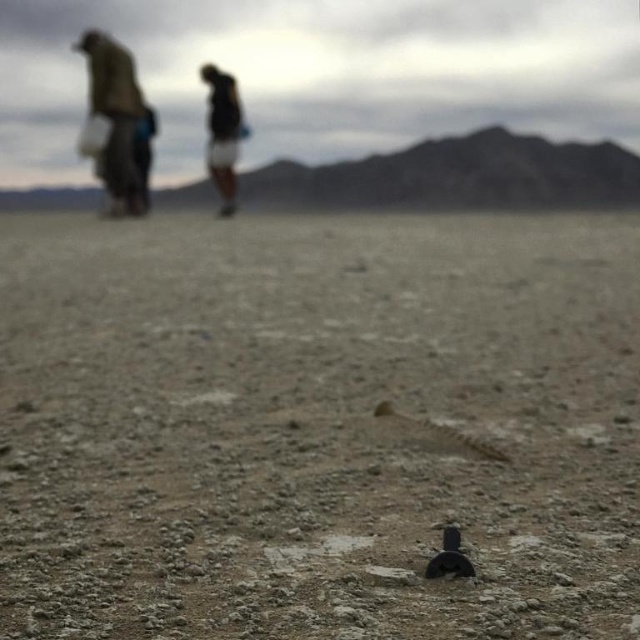
You are a traveler in the desert and see two jackets hanging on a cactus. The jackets are the brown fabric jacket at upper left and the dark brown leather jacket at upper center. Which jacket is closer to the left side of the cactus?

The brown fabric jacket at upper left is positioned on the left side of the dark brown leather jacket at upper center, so it is closer to the left side of the cactus.

You are a photographer trying to capture the dull brown dirt at center and the dark brown fabric at upper left in the same frame. Based on their positions, which object will appear larger in your photo?

The dull brown dirt at center will appear larger in the photo because it is closer to the viewer than the dark brown fabric at upper left.

You are a photographer trying to capture the two figures walking away in the desert. You notice a point at coordinates point (115, 120). Where is this point located?

The point (115, 120) is located on the brown fabric jacket at upper left.